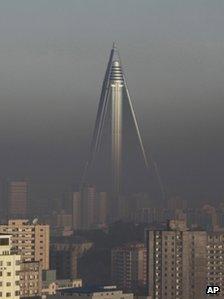
Locate an element on the screen. The image size is (224, 299). floors is located at coordinates (162, 245).